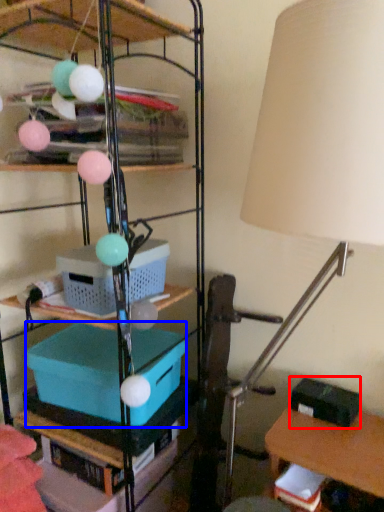
Question: Which of the following is the farthest to the observer, storage box (highlighted by a red box) or storage box (highlighted by a blue box)?

Choices:
 (A) storage box
 (B) storage box

Answer: (A)